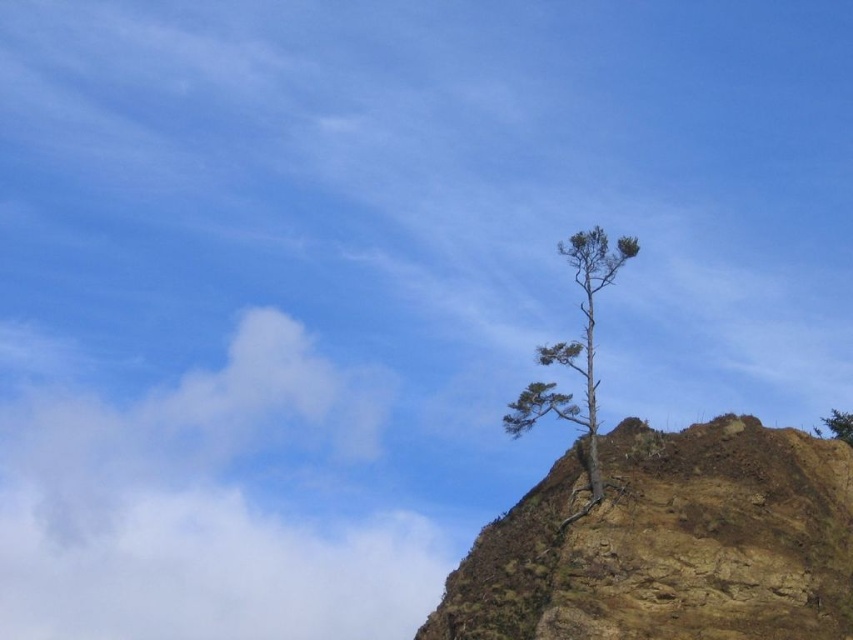
Which is below, brown rocky cliff at upper right or green leafy tree at upper right?

brown rocky cliff at upper right is lower down.

Is point (660, 500) closer to camera compared to point (827, 424)?

Yes.

The image size is (853, 640). I want to click on brown rocky cliff at upper right, so click(x=669, y=544).

Between green textured tree at upper right and green leafy tree at upper right, which one is positioned lower?

green leafy tree at upper right

Does green textured tree at upper right have a greater width compared to green leafy tree at upper right?

→ No.

Image resolution: width=853 pixels, height=640 pixels. In order to click on green textured tree at upper right in this screenshot , I will do `click(575, 355)`.

Can you confirm if brown rocky cliff at upper right is smaller than green textured tree at upper right?

No, brown rocky cliff at upper right is not smaller than green textured tree at upper right.

In the scene shown: Which is more to the left, brown rocky cliff at upper right or green textured tree at upper right?

From the viewer's perspective, green textured tree at upper right appears more on the left side.

The image size is (853, 640). In order to click on brown rocky cliff at upper right in this screenshot , I will do `click(669, 544)`.